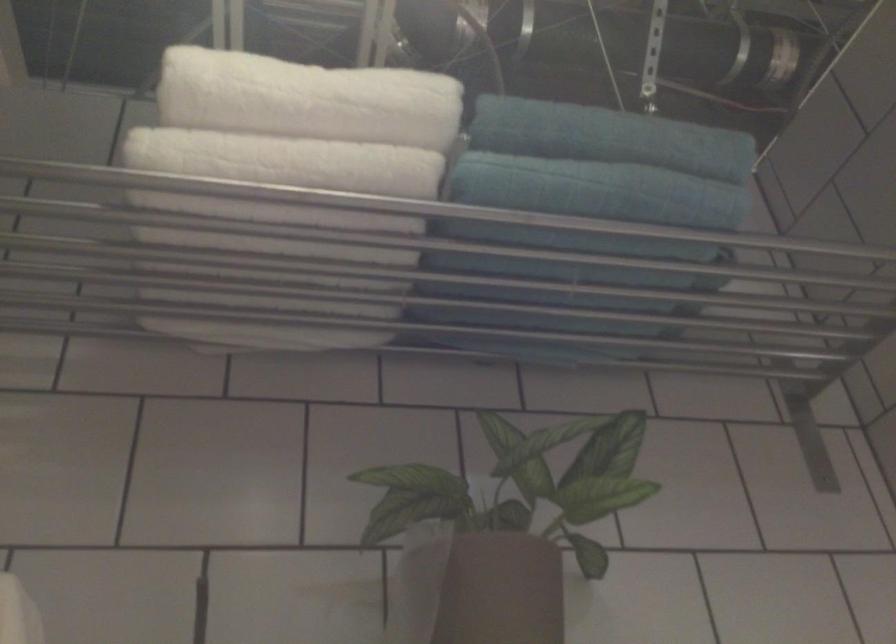
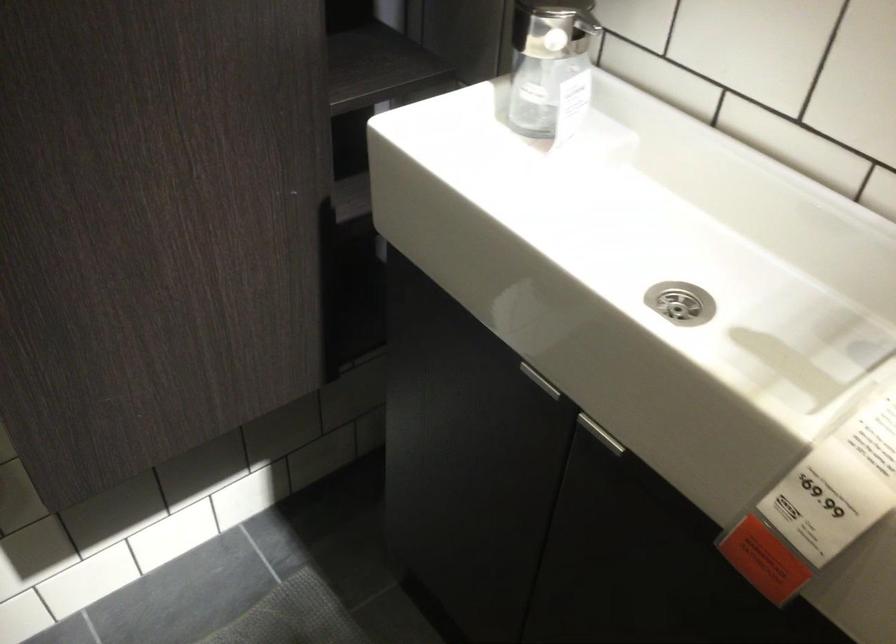
Based on the continuous images, in which direction is the camera rotating?

The camera rotated toward right-down.